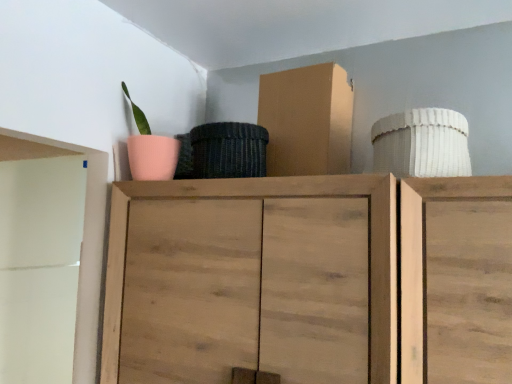
Describe the element at coordinates (310, 280) in the screenshot. The width and height of the screenshot is (512, 384). I see `wooden cabinet at center` at that location.

Where is `wooden cabinet at center`? The width and height of the screenshot is (512, 384). wooden cabinet at center is located at coordinates (310, 280).

The height and width of the screenshot is (384, 512). What are the coordinates of `cardboard box at upper center` in the screenshot? It's located at (307, 120).

Describe the element at coordinates (307, 120) in the screenshot. I see `cardboard box at upper center` at that location.

I want to click on wooden cabinet at center, so click(x=310, y=280).

Can you confirm if cardboard box at upper center is positioned to the right of wooden cabinet at center?

Indeed, cardboard box at upper center is positioned on the right side of wooden cabinet at center.

Who is more distant, cardboard box at upper center or wooden cabinet at center?

cardboard box at upper center is further from the camera.

Between point (337, 117) and point (481, 292), which one is positioned behind?

The point (337, 117) is farther.

In the scene shown: From the image's perspective, between cardboard box at upper center and wooden cabinet at center, who is located below?

From the image's view, wooden cabinet at center is below.

From a real-world perspective, which object rests below the other?

wooden cabinet at center.

Considering the sizes of cardboard box at upper center and wooden cabinet at center in the image, is cardboard box at upper center wider or thinner than wooden cabinet at center?

In the image, cardboard box at upper center appears to be more narrow than wooden cabinet at center.

Considering the relative sizes of cardboard box at upper center and wooden cabinet at center in the image provided, is cardboard box at upper center shorter than wooden cabinet at center?

Yes.

Between cardboard box at upper center and wooden cabinet at center, which one has larger size?

wooden cabinet at center.

Could wooden cabinet at center be considered to be inside cardboard box at upper center?

No, cardboard box at upper center does not contain wooden cabinet at center.

Are cardboard box at upper center and wooden cabinet at center making contact?

No, cardboard box at upper center is not touching wooden cabinet at center.

Is cardboard box at upper center turned away from wooden cabinet at center?

No, wooden cabinet at center is not at the back of cardboard box at upper center.

What's the angular difference between cardboard box at upper center and wooden cabinet at center's facing directions?

The angle between the facing direction of cardboard box at upper center and the facing direction of wooden cabinet at center is 2.21 degrees.

The height and width of the screenshot is (384, 512). Find the location of `cardboard box behind the wooden cabinet at center`. cardboard box behind the wooden cabinet at center is located at coordinates (307, 120).

Can you confirm if wooden cabinet at center is positioned to the left of cardboard box at upper center?

Yes.

Which is behind, wooden cabinet at center or cardboard box at upper center?

cardboard box at upper center is more distant.

Considering the points (486, 201) and (331, 144), which point is in front, point (486, 201) or point (331, 144)?

Point (486, 201)

From the image's perspective, which one is positioned lower, wooden cabinet at center or cardboard box at upper center?

From the image's view, wooden cabinet at center is below.

From a real-world perspective, is wooden cabinet at center beneath cardboard box at upper center?

Indeed, from a real-world perspective, wooden cabinet at center is positioned beneath cardboard box at upper center.

Consider the image. Considering the relative sizes of wooden cabinet at center and cardboard box at upper center in the image provided, is wooden cabinet at center wider than cardboard box at upper center?

Correct, the width of wooden cabinet at center exceeds that of cardboard box at upper center.

In the scene shown: Does wooden cabinet at center have a greater height compared to cardboard box at upper center?

Correct, wooden cabinet at center is much taller as cardboard box at upper center.

Is wooden cabinet at center smaller than cardboard box at upper center?

Actually, wooden cabinet at center might be larger than cardboard box at upper center.

Would you say cardboard box at upper center is part of wooden cabinet at center's contents?

Definitely not — cardboard box at upper center is not inside wooden cabinet at center.

Is wooden cabinet at center touching cardboard box at upper center?

No, wooden cabinet at center is not making contact with cardboard box at upper center.

Is wooden cabinet at center aimed at cardboard box at upper center?

No, wooden cabinet at center is not turned towards cardboard box at upper center.

Find the location of a particular element. This screenshot has height=384, width=512. cupboard on the left of cardboard box at upper center is located at coordinates (310, 280).

The image size is (512, 384). I want to click on cupboard that appears below the cardboard box at upper center (from the image's perspective), so coord(310,280).

This screenshot has width=512, height=384. Identify the location of cardboard box that appears above the wooden cabinet at center (from the image's perspective). [307, 120].